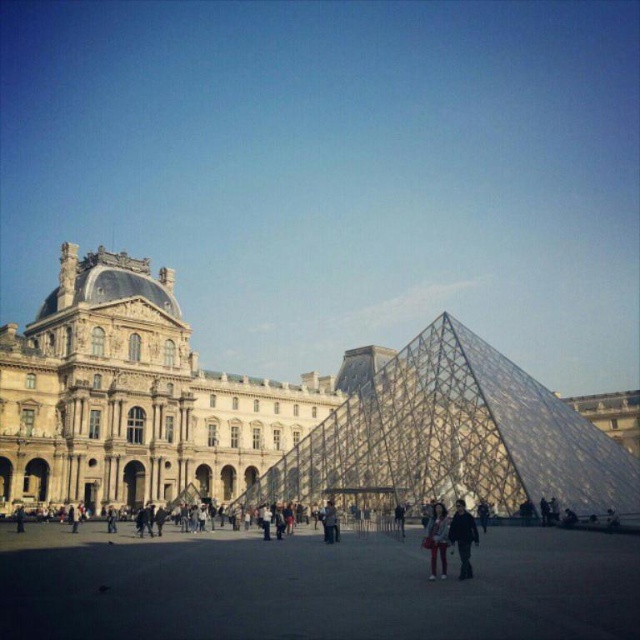
You are visiting the Louvre Museum and want to take a photo of the transparent glass pyramid at center. However, there is a person wearing a dark gray jacket at lower left blocking your view. Can you estimate if the pyramid is taller than the person? Explain your reasoning based on the scene.

The transparent glass pyramid at center has a greater height compared to the dark gray jacket at lower left, so yes, the pyramid is taller than the person wearing the dark gray jacket at lower left.

You are standing at the entrance of the Louvre Museum and see the dark gray concrete plaza at center and the light brown leather jacket at center. Which object is positioned to the left?

The dark gray concrete plaza at center is to the left of the light brown leather jacket at center.

You are standing in front of the Louvre Museum and see a dark brown leather jacket at center and a denim jacket at lower center. Which jacket is closer to you?

The dark brown leather jacket at center is closer to you because it is in front of the denim jacket at lower center.